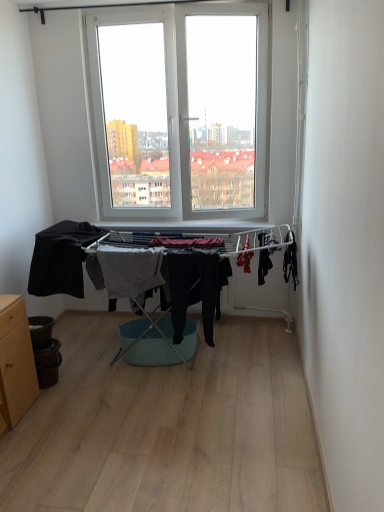
Question: From a real-world perspective, is wooden cabinet at lower left positioned above or below black matte pants at center, the second clothing from the right?

Choices:
 (A) above
 (B) below

Answer: (B)

Question: Is wooden cabinet at lower left inside the boundaries of black matte pants at center, the second clothing from the right, or outside?

Choices:
 (A) outside
 (B) inside

Answer: (A)

Question: Which object is the farthest from the black matte clothing at right, marked as the fourth clothing in a left-to-right arrangement?

Choices:
 (A) gray cotton towel at center, which appears as the third clothing when viewed from the right
 (B) black matte fabric at left, acting as the 1th clothing starting from the left
 (C) black matte pants at center, the second clothing from the right
 (D) wooden cabinet at lower left

Answer: (D)

Question: Estimate the real-world distances between objects in this image. Which object is farther from the gray cotton towel at center, which appears as the third clothing when viewed from the right?

Choices:
 (A) wooden cabinet at lower left
 (B) black matte pants at center, which appears as the third clothing when viewed from the left
 (C) black matte fabric at left, the 4th clothing when ordered from right to left
 (D) black matte clothing at right, marked as the fourth clothing in a left-to-right arrangement

Answer: (D)